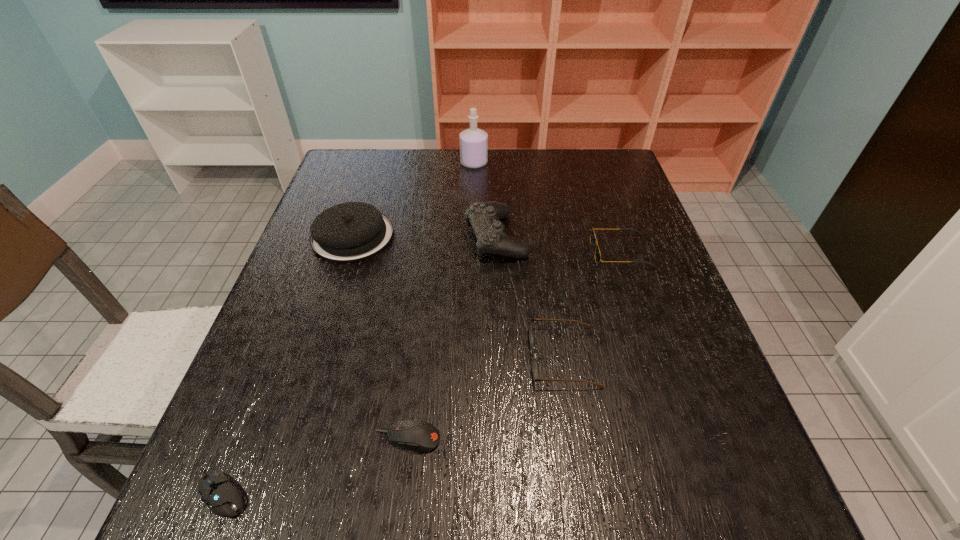
The image size is (960, 540). Identify the location of vacant region between the second tallest object and the right computer mouse. (452, 337).

Locate which object is the fourth closest to the pancake. Please provide its 2D coordinates. Your answer should be formatted as a tuple, i.e. [(x, y)], where the tuple contains the x and y coordinates of a point satisfying the conditions above.

[(420, 436)]

Identify which object is located as the nearest to the fourth shortest object. Please provide its 2D coordinates. Your answer should be formatted as a tuple, i.e. [(x, y)], where the tuple contains the x and y coordinates of a point satisfying the conditions above.

[(490, 233)]